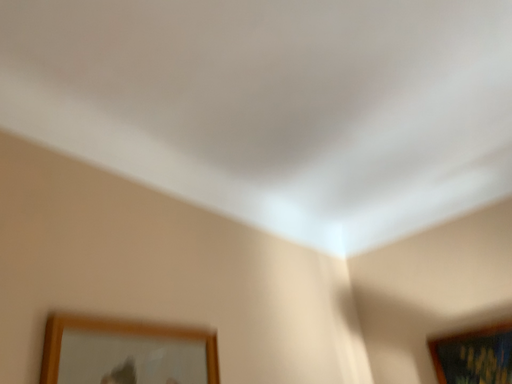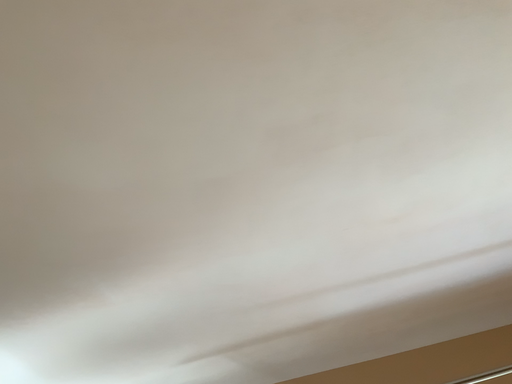
Question: Which way did the camera rotate in the video?

Choices:
 (A) rotated upward
 (B) rotated downward

Answer: (A)